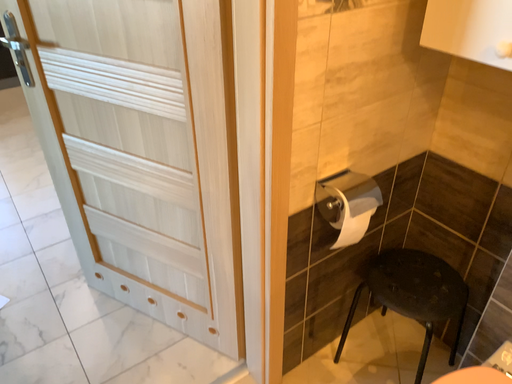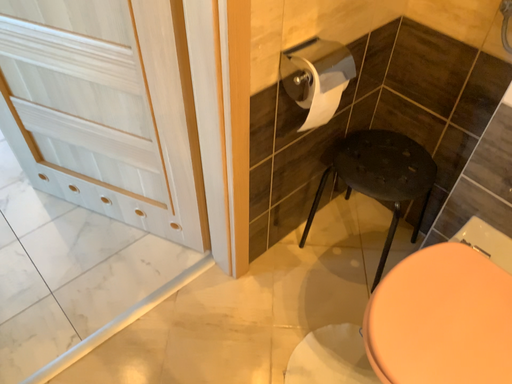
Question: Which way did the camera rotate in the video?

Choices:
 (A) rotated downward
 (B) rotated upward

Answer: (A)